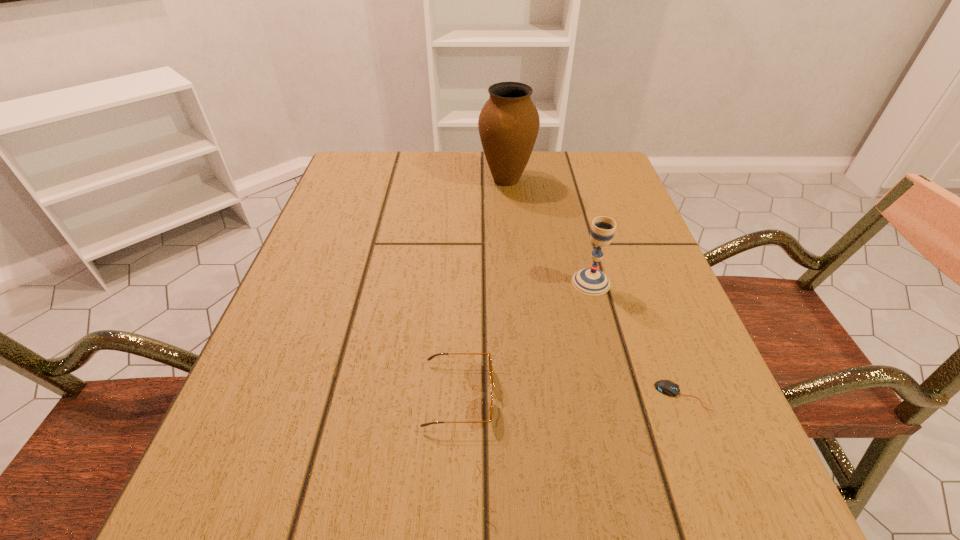
The height and width of the screenshot is (540, 960). Identify the location of the tallest object. (508, 124).

At what (x,y) coordinates should I click in order to perform the action: click on urn. Please return your answer as a coordinate pair (x, y). This screenshot has width=960, height=540. Looking at the image, I should click on (508, 124).

Locate an element on the screen. This screenshot has width=960, height=540. chalice is located at coordinates (590, 281).

Where is `the third shortest object`? the third shortest object is located at coordinates pos(590,281).

Where is `the second shortest object`? The image size is (960, 540). the second shortest object is located at coordinates (431, 357).

Where is `the rightmost object`? The height and width of the screenshot is (540, 960). the rightmost object is located at coordinates (667, 387).

This screenshot has width=960, height=540. Find the location of `the shortest object`. the shortest object is located at coordinates (667, 387).

Where is `vacant space located on the right of the tallest object`? This screenshot has height=540, width=960. vacant space located on the right of the tallest object is located at coordinates (609, 179).

Locate an element on the screen. The width and height of the screenshot is (960, 540). free location located on the back of the third nearest object is located at coordinates (567, 192).

Locate an element on the screen. The width and height of the screenshot is (960, 540). free location located 0.340m on the lenses of the second shortest object is located at coordinates (716, 395).